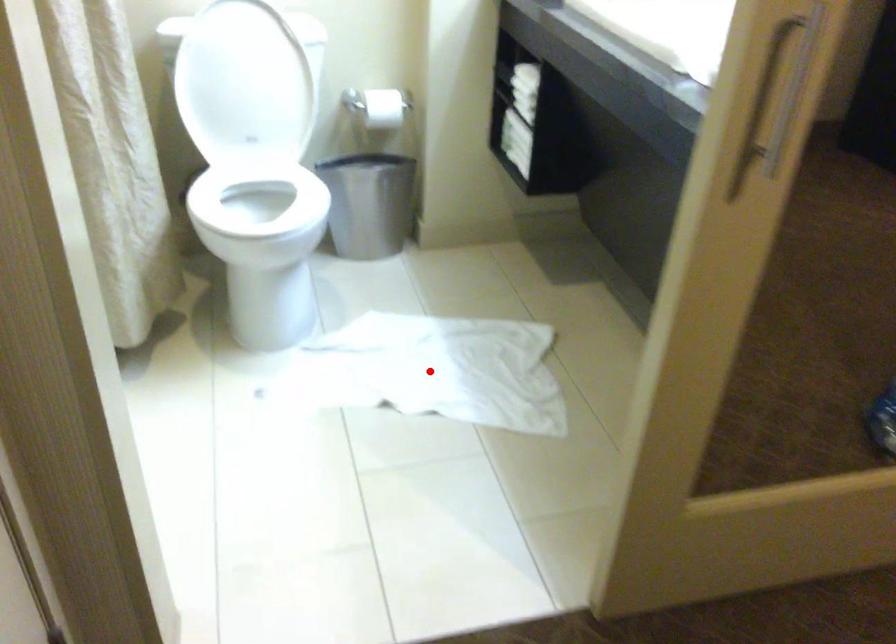
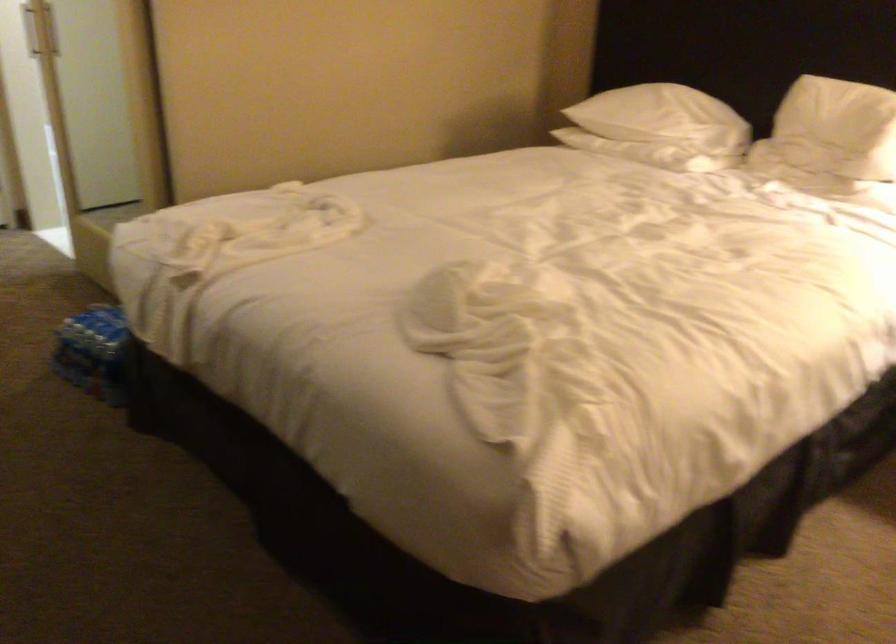
Question: I am providing you with two images of the same scene from different viewpoints. A red point is marked on the first image. At the location where the point appears in image 1, is it still visible in image 2?

Choices:
 (A) Yes
 (B) No

Answer: (B)